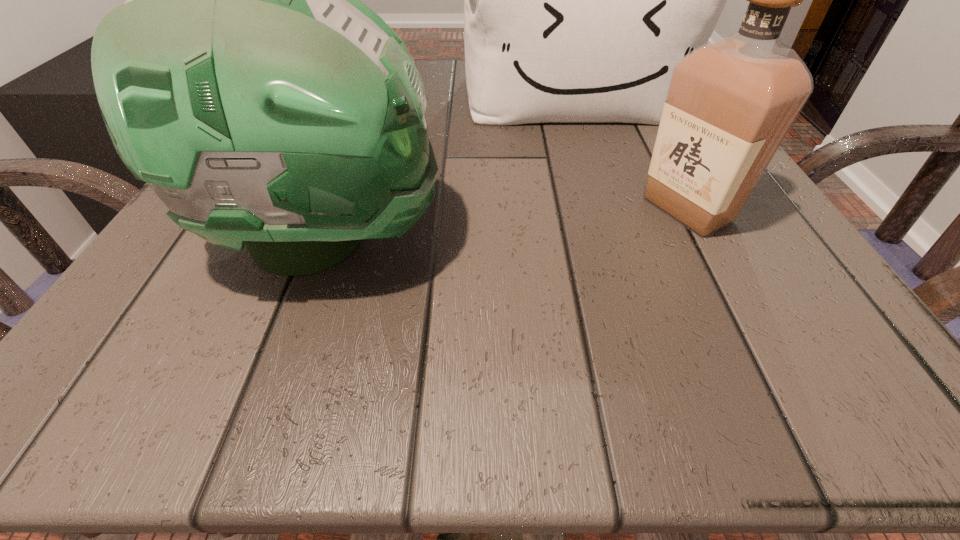
This screenshot has width=960, height=540. I want to click on cushion that is at the right edge, so click(579, 0).

At what (x,y) coordinates should I click in order to perform the action: click on liquor positioned at the right edge. Please return your answer as a coordinate pair (x, y). Looking at the image, I should click on (731, 102).

Identify the location of object located in the far right corner section of the desktop. The image size is (960, 540). (579, 0).

Where is `vacant area at the far edge`? vacant area at the far edge is located at coordinates (424, 64).

Locate an element on the screen. The height and width of the screenshot is (540, 960). vacant region at the near edge of the desktop is located at coordinates (x=709, y=380).

In order to click on free space at the left edge of the desktop in this screenshot , I will do `click(228, 255)`.

The image size is (960, 540). I want to click on vacant space at the right edge of the desktop, so tap(794, 301).

Where is `free space at the near left corner of the desktop`? The width and height of the screenshot is (960, 540). free space at the near left corner of the desktop is located at coordinates (142, 332).

Locate an element on the screen. Image resolution: width=960 pixels, height=540 pixels. unoccupied area between the leftmost object and the liquor is located at coordinates (507, 225).

Find the location of a particular element. This screenshot has height=540, width=960. vacant area between the liquor and the leftmost object is located at coordinates (507, 225).